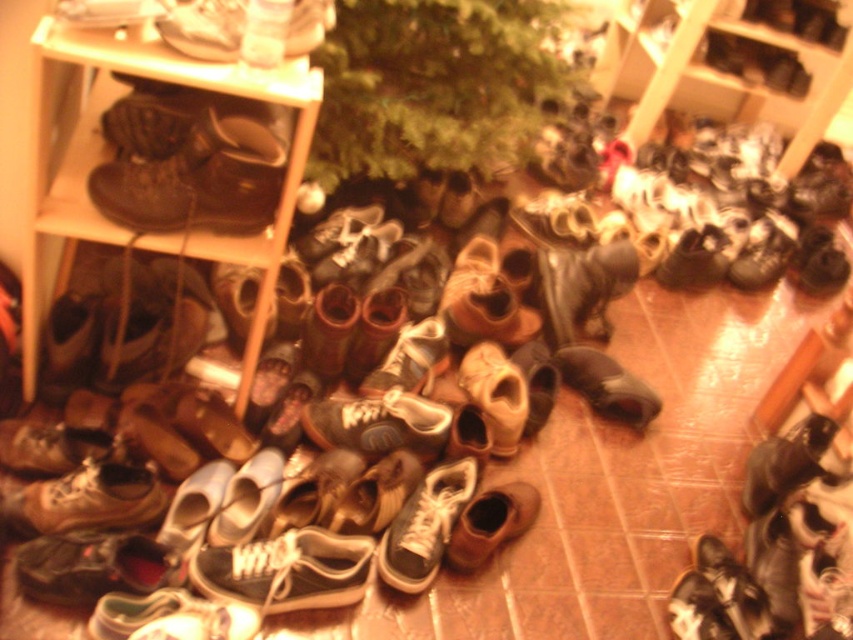
In the scene shown: Which is more to the right, black canvas sneaker at center or brown leather sneaker at lower left?

Positioned to the right is black canvas sneaker at center.

Can you confirm if black canvas sneaker at center is bigger than brown leather sneaker at lower left?

Correct, black canvas sneaker at center is larger in size than brown leather sneaker at lower left.

Is point (305, 557) closer to viewer compared to point (125, 518)?

Yes, it is.

The image size is (853, 640). I want to click on black canvas sneaker at center, so click(x=286, y=570).

Does point (431, 568) lie behind point (164, 38)?

Yes.

Between matte black sneaker at center and matte white shoe at upper left, which one is positioned higher?

matte white shoe at upper left is higher up.

Describe the element at coordinates (425, 525) in the screenshot. I see `matte black sneaker at center` at that location.

Locate an element on the screen. This screenshot has width=853, height=640. matte black sneaker at center is located at coordinates (425, 525).

Is point (468, 467) positioned after point (616, 385)?

No, (468, 467) is in front of (616, 385).

Describe the element at coordinates (425, 525) in the screenshot. This screenshot has height=640, width=853. I see `matte black sneaker at center` at that location.

Where is `matte black sneaker at center`? This screenshot has width=853, height=640. matte black sneaker at center is located at coordinates (425, 525).

Find the location of a particular element. matte black sneaker at center is located at coordinates tap(425, 525).